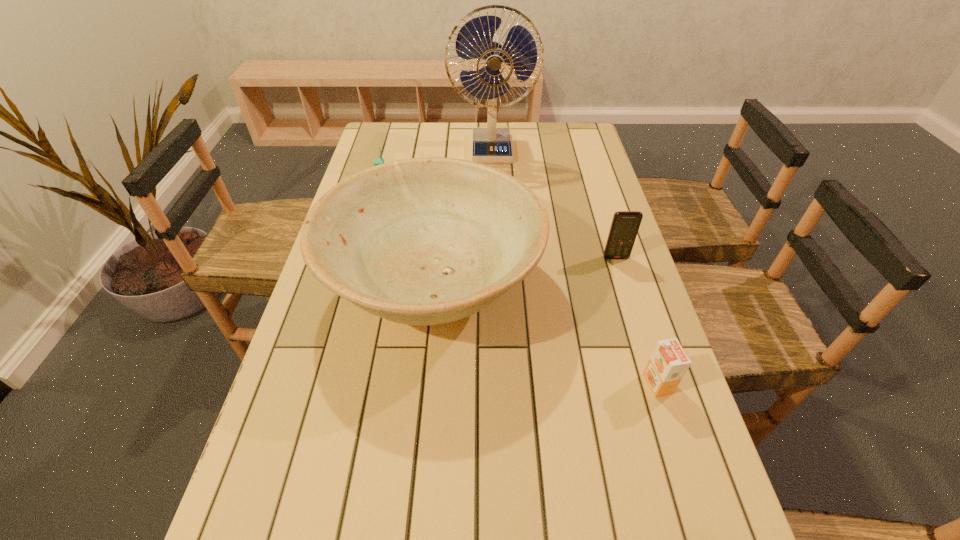
Where is `free space located 0.140m on the keypad of the shorter cellular telephone`? This screenshot has width=960, height=540. free space located 0.140m on the keypad of the shorter cellular telephone is located at coordinates (374, 217).

Where is `vacant region located 0.260m on the left of the orange juice`? The image size is (960, 540). vacant region located 0.260m on the left of the orange juice is located at coordinates (520, 383).

This screenshot has width=960, height=540. Identify the location of object that is at the far edge. (477, 38).

Find the location of a particular element. The image size is (960, 540). dish that is at the left edge is located at coordinates (423, 241).

Locate an element on the screen. cellular telephone located at the left edge is located at coordinates (377, 161).

The width and height of the screenshot is (960, 540). In order to click on cellular telephone that is positioned at the right edge in this screenshot , I will do `click(625, 224)`.

This screenshot has width=960, height=540. What are the coordinates of `orange juice located at the right edge` in the screenshot? It's located at (668, 363).

Find the location of a particular element. This screenshot has height=540, width=960. blank space at the far edge of the desktop is located at coordinates [529, 129].

The width and height of the screenshot is (960, 540). Find the location of `vacant space at the left edge of the desktop`. vacant space at the left edge of the desktop is located at coordinates (279, 501).

You are a GUI agent. You are given a task and a screenshot of the screen. Output one action in this format:
    pyautogui.click(x=<x>, y=<y>)
    Task: Click on the free location at the right edge of the desktop
    
    Given the screenshot: What is the action you would take?
    pyautogui.click(x=602, y=203)